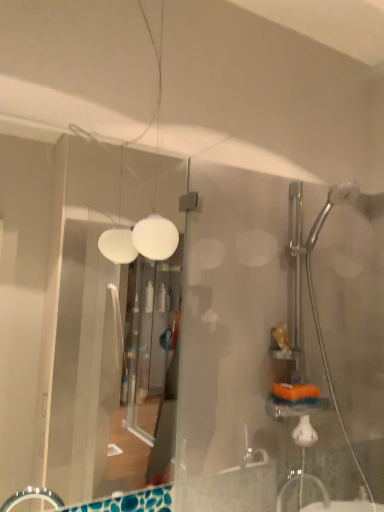
Question: Is transparent glass door at left taller than white matte light fixture at upper center?

Choices:
 (A) no
 (B) yes

Answer: (B)

Question: Does transparent glass door at left have a smaller size compared to white matte light fixture at upper center?

Choices:
 (A) no
 (B) yes

Answer: (A)

Question: Is transparent glass door at left oriented towards white matte light fixture at upper center?

Choices:
 (A) no
 (B) yes

Answer: (B)

Question: From the image's perspective, does transparent glass door at left appear lower than white matte light fixture at upper center?

Choices:
 (A) yes
 (B) no

Answer: (A)

Question: From a real-world perspective, is transparent glass door at left under white matte light fixture at upper center?

Choices:
 (A) yes
 (B) no

Answer: (A)

Question: Considering the relative sizes of transparent glass door at left and white matte light fixture at upper center in the image provided, is transparent glass door at left thinner than white matte light fixture at upper center?

Choices:
 (A) no
 (B) yes

Answer: (B)

Question: Does white matte light fixture at upper center have a lesser height compared to transparent glass door at left?

Choices:
 (A) no
 (B) yes

Answer: (B)

Question: Is white matte light fixture at upper center to the right of transparent glass door at left from the viewer's perspective?

Choices:
 (A) yes
 (B) no

Answer: (A)

Question: Considering the relative sizes of white matte light fixture at upper center and transparent glass door at left in the image provided, is white matte light fixture at upper center bigger than transparent glass door at left?

Choices:
 (A) yes
 (B) no

Answer: (B)

Question: Can you confirm if white matte light fixture at upper center is taller than transparent glass door at left?

Choices:
 (A) no
 (B) yes

Answer: (A)

Question: Can transparent glass door at left be found inside white matte light fixture at upper center?

Choices:
 (A) no
 (B) yes

Answer: (A)

Question: Does white matte light fixture at upper center turn towards transparent glass door at left?

Choices:
 (A) no
 (B) yes

Answer: (A)

Question: In terms of width, does white matte light fixture at upper center look wider or thinner when compared to transparent glass door at left?

Choices:
 (A) wide
 (B) thin

Answer: (A)